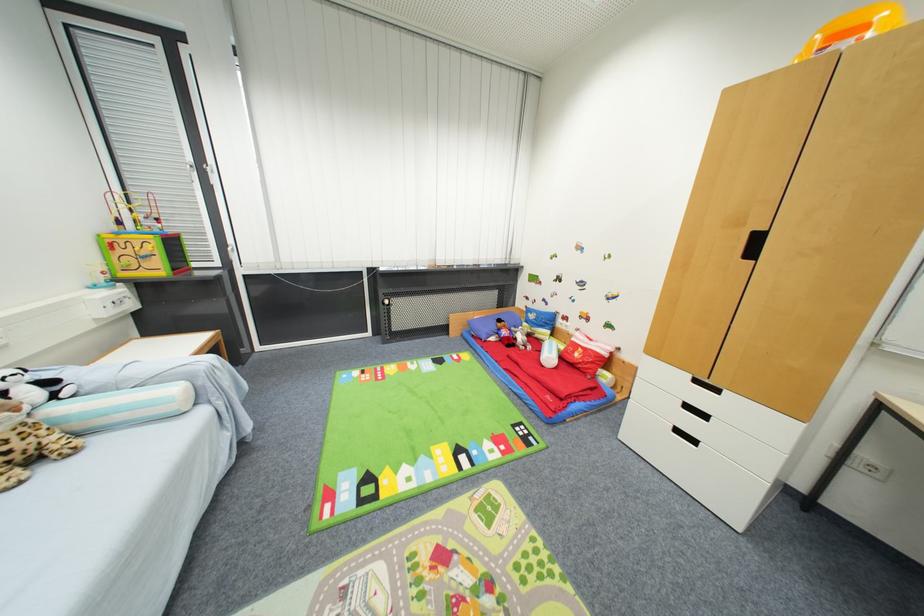
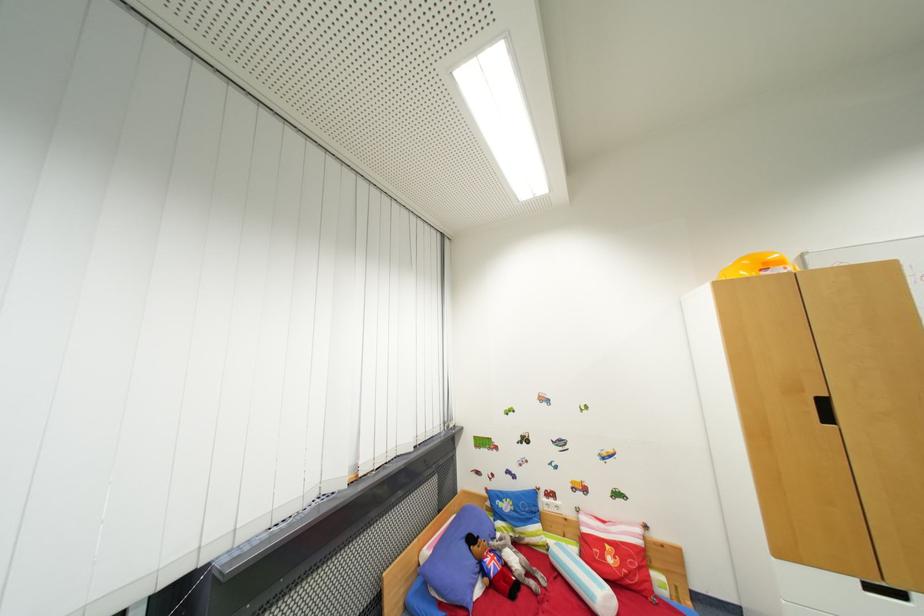
Locate, in the second image, the point that corresponds to point (869, 30) in the first image.

(785, 265)